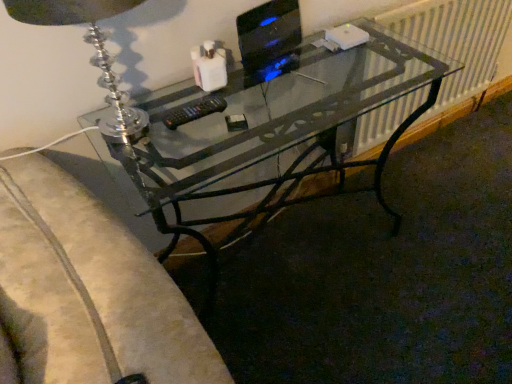
Locate an element on the screen. The width and height of the screenshot is (512, 384). free spot behind black plastic remote at center is located at coordinates (214, 94).